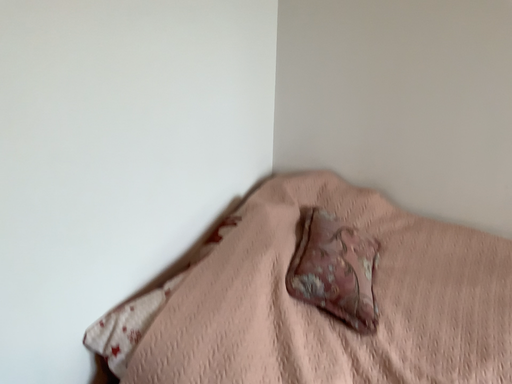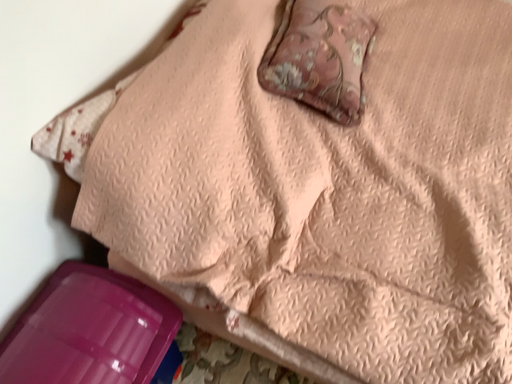
Question: How did the camera likely rotate when shooting the video?

Choices:
 (A) rotated downward
 (B) rotated upward

Answer: (A)